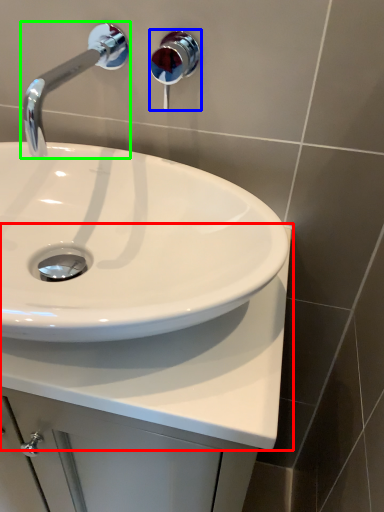
Question: Considering the real-world distances, which object is closest to counter top (highlighted by a red box)? shower (highlighted by a blue box) or tap (highlighted by a green box).

Choices:
 (A) shower
 (B) tap

Answer: (B)